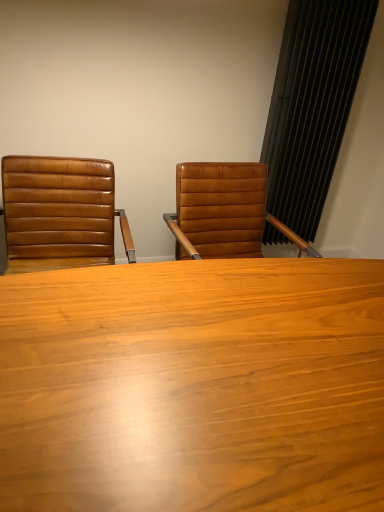
Question: Is brown leather chair at left far from black textured curtain at right?

Choices:
 (A) yes
 (B) no

Answer: (A)

Question: Considering the relative positions of brown leather chair at left and black textured curtain at right in the image provided, is brown leather chair at left to the left of black textured curtain at right from the viewer's perspective?

Choices:
 (A) no
 (B) yes

Answer: (B)

Question: From a real-world perspective, does brown leather chair at left sit lower than black textured curtain at right?

Choices:
 (A) no
 (B) yes

Answer: (B)

Question: Could you tell me if brown leather chair at left is facing black textured curtain at right?

Choices:
 (A) yes
 (B) no

Answer: (B)

Question: Does brown leather chair at left come in front of black textured curtain at right?

Choices:
 (A) no
 (B) yes

Answer: (B)

Question: From a real-world perspective, relative to brown leather chair at left, is black textured curtain at right vertically above or below?

Choices:
 (A) above
 (B) below

Answer: (A)

Question: From the image's perspective, is black textured curtain at right positioned above or below brown leather chair at left?

Choices:
 (A) above
 (B) below

Answer: (A)

Question: Based on their positions, is black textured curtain at right located to the left or right of brown leather chair at left?

Choices:
 (A) left
 (B) right

Answer: (B)

Question: Based on their sizes in the image, would you say black textured curtain at right is bigger or smaller than brown leather chair at left?

Choices:
 (A) big
 (B) small

Answer: (B)

Question: In the image, is black textured curtain at right positioned in front of or behind wooden table at center?

Choices:
 (A) front
 (B) behind

Answer: (B)

Question: Is black textured curtain at right inside or outside of wooden table at center?

Choices:
 (A) outside
 (B) inside

Answer: (A)

Question: Is point (289, 180) closer or farther from the camera than point (84, 297)?

Choices:
 (A) closer
 (B) farther

Answer: (B)

Question: From the image's perspective, is black textured curtain at right above or below wooden table at center?

Choices:
 (A) above
 (B) below

Answer: (A)

Question: From the image's perspective, relative to black textured curtain at right, is brown leather chair at left above or below?

Choices:
 (A) above
 (B) below

Answer: (B)

Question: Is point (89, 201) closer or farther from the camera than point (329, 86)?

Choices:
 (A) closer
 (B) farther

Answer: (A)